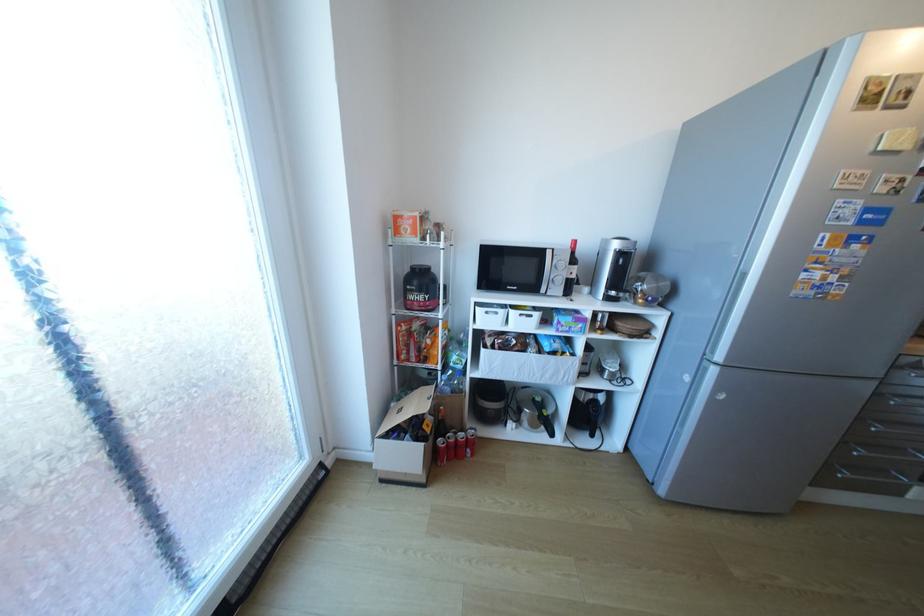
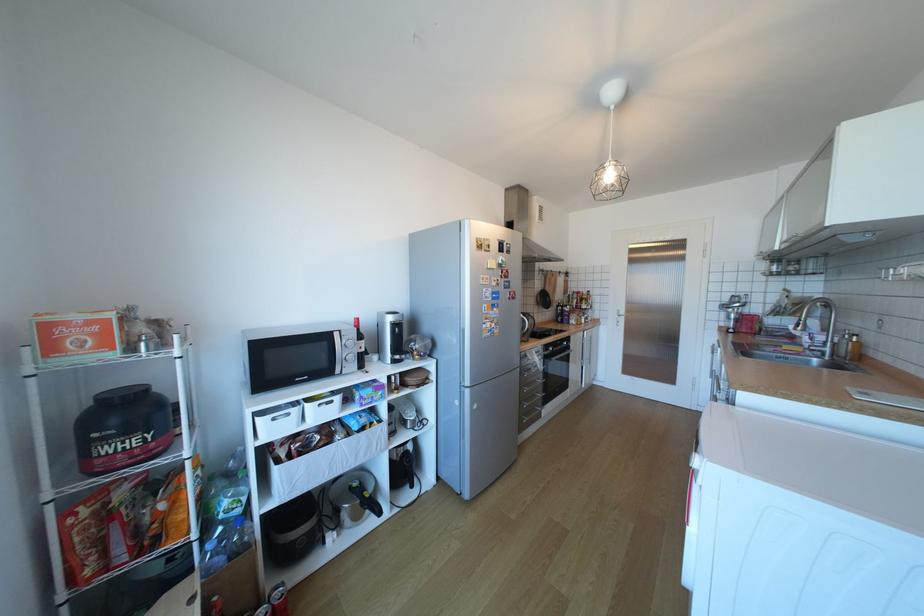
Locate, in the second image, the point that corresponds to pixel 853 443 in the first image.

(529, 403)